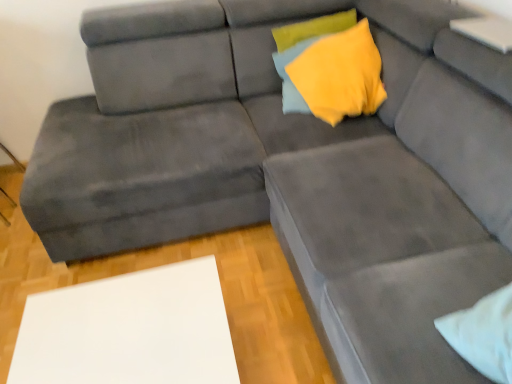
Question: Considering the positions of yellow fabric pillow at upper center and white matte table at lower left in the image, is yellow fabric pillow at upper center bigger or smaller than white matte table at lower left?

Choices:
 (A) big
 (B) small

Answer: (B)

Question: Considering their positions, is yellow fabric pillow at upper center located in front of or behind white matte table at lower left?

Choices:
 (A) behind
 (B) front

Answer: (A)

Question: From a real-world perspective, relative to white matte table at lower left, is yellow fabric pillow at upper center vertically above or below?

Choices:
 (A) below
 (B) above

Answer: (B)

Question: Is white matte table at lower left bigger or smaller than yellow fabric pillow at upper center?

Choices:
 (A) big
 (B) small

Answer: (A)

Question: Considering the positions of white matte table at lower left and yellow fabric pillow at upper center in the image, is white matte table at lower left taller or shorter than yellow fabric pillow at upper center?

Choices:
 (A) short
 (B) tall

Answer: (B)

Question: Considering the positions of point (75, 377) and point (340, 16), is point (75, 377) closer or farther from the camera than point (340, 16)?

Choices:
 (A) farther
 (B) closer

Answer: (B)

Question: Is white matte table at lower left wider or thinner than yellow fabric pillow at upper center?

Choices:
 (A) thin
 (B) wide

Answer: (B)